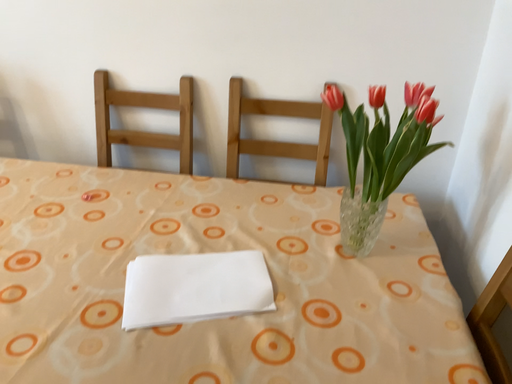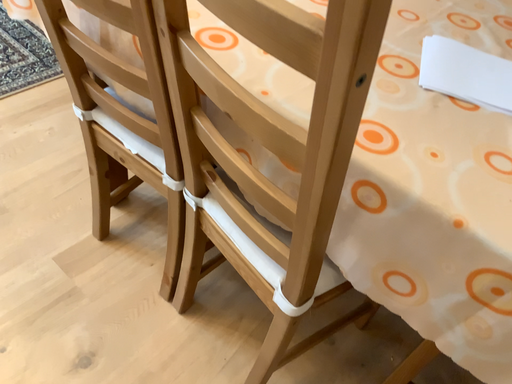
Question: Which way did the camera rotate in the video?

Choices:
 (A) rotated downward
 (B) rotated upward

Answer: (A)